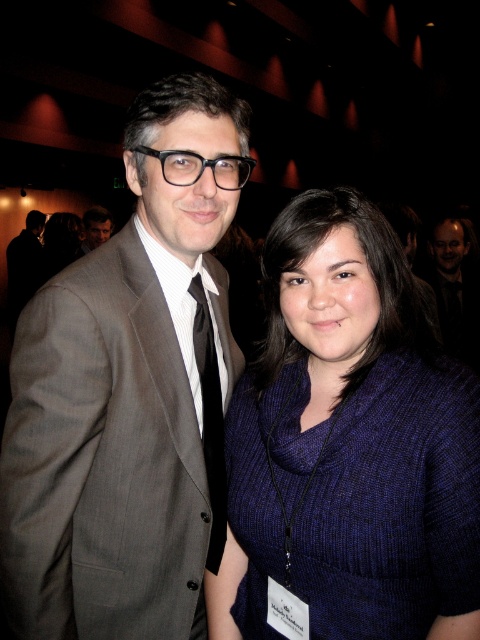
Question: Considering the relative positions of matte gray suit at center and dark gray suit at center in the image provided, where is matte gray suit at center located with respect to dark gray suit at center?

Choices:
 (A) left
 (B) right

Answer: (A)

Question: Which point is farther from the camera taking this photo?

Choices:
 (A) (302, 458)
 (B) (460, 275)

Answer: (B)

Question: Can you confirm if matte gray suit at center is thinner than matte black suit at left?

Choices:
 (A) no
 (B) yes

Answer: (A)

Question: In this image, where is black satin tie at center located relative to matte black suit at left?

Choices:
 (A) right
 (B) left

Answer: (A)

Question: Which point is farther from the camera taking this photo?

Choices:
 (A) (459, 346)
 (B) (447, 380)
 (C) (216, 404)
 (D) (29, 582)

Answer: (A)

Question: Which of the following is the closest to the observer?

Choices:
 (A) (122, 246)
 (B) (354, 451)
 (C) (225, 522)
 (D) (84, 232)

Answer: (B)